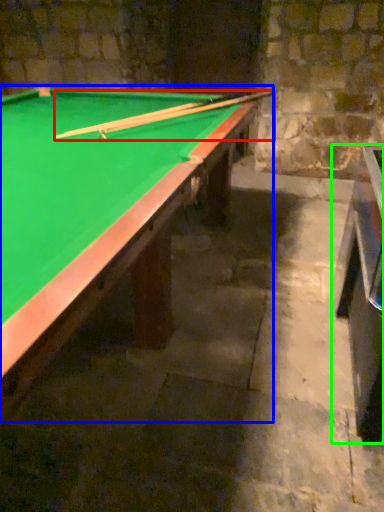
Question: Which object is positioned closest to cue (highlighted by a red box)? Select from billiard table (highlighted by a blue box) and table (highlighted by a green box).

Choices:
 (A) billiard table
 (B) table

Answer: (A)